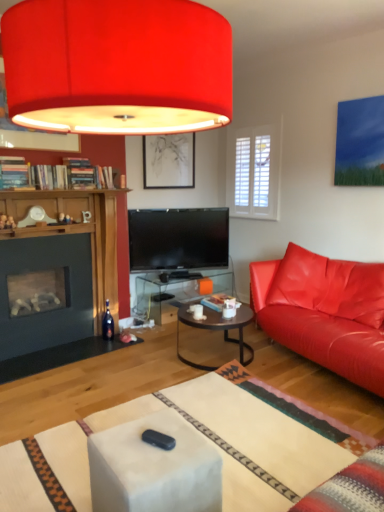
Question: Should I look upward or downward to see matte leather couch at right?

Choices:
 (A) up
 (B) down

Answer: (B)

Question: From a real-world perspective, is matte leather couch at right on top of dark glass wine bottle at lower left?

Choices:
 (A) yes
 (B) no

Answer: (A)

Question: Is matte leather couch at right next to dark glass wine bottle at lower left and touching it?

Choices:
 (A) no
 (B) yes

Answer: (A)

Question: From the image's perspective, is matte leather couch at right beneath dark glass wine bottle at lower left?

Choices:
 (A) yes
 (B) no

Answer: (B)

Question: Is there a large distance between matte leather couch at right and dark glass wine bottle at lower left?

Choices:
 (A) no
 (B) yes

Answer: (B)

Question: Is matte leather couch at right looking in the opposite direction of dark glass wine bottle at lower left?

Choices:
 (A) no
 (B) yes

Answer: (A)

Question: Can you confirm if matte leather couch at right is shorter than dark glass wine bottle at lower left?

Choices:
 (A) no
 (B) yes

Answer: (A)

Question: Can you confirm if matte black picture frame at upper center is wider than dark glass wine bottle at lower left?

Choices:
 (A) yes
 (B) no

Answer: (B)

Question: Is matte black picture frame at upper center placed right next to dark glass wine bottle at lower left?

Choices:
 (A) yes
 (B) no

Answer: (B)

Question: Does matte black picture frame at upper center have a larger size compared to dark glass wine bottle at lower left?

Choices:
 (A) no
 (B) yes

Answer: (B)

Question: Is dark glass wine bottle at lower left located within matte black picture frame at upper center?

Choices:
 (A) yes
 (B) no

Answer: (B)

Question: From the image's perspective, is matte black picture frame at upper center located above dark glass wine bottle at lower left?

Choices:
 (A) yes
 (B) no

Answer: (A)

Question: Is matte black picture frame at upper center located outside dark glass wine bottle at lower left?

Choices:
 (A) no
 (B) yes

Answer: (B)

Question: Does matte black picture frame at upper center have a greater width compared to dark brown glass coffee table at center?

Choices:
 (A) yes
 (B) no

Answer: (B)